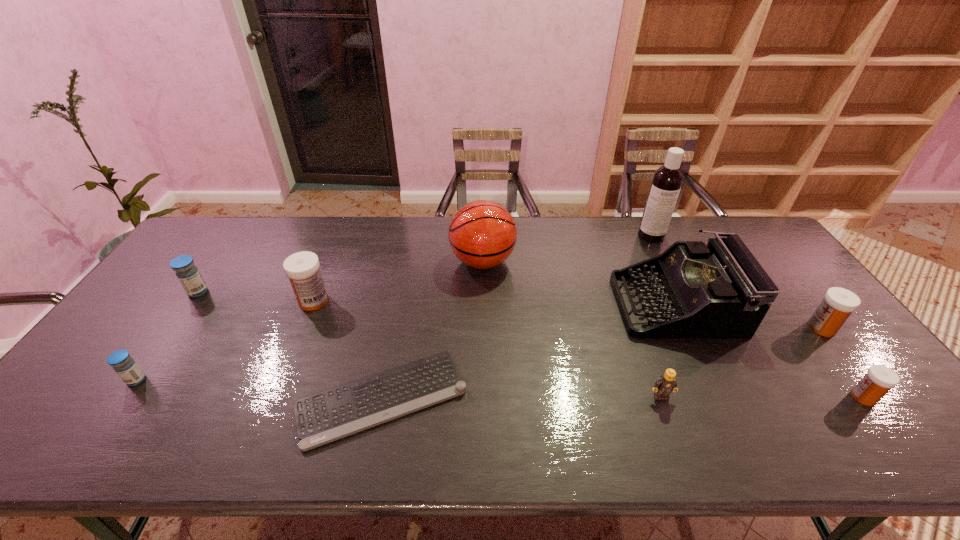
Locate an element on the screen. This screenshot has width=960, height=540. vacant point located 0.110m on the front of the farthest white medicine is located at coordinates (298, 341).

At what (x,y) coordinates should I click in order to perform the action: click on vacant region located on the back of the third farthest medicine. Please return your answer as a coordinate pair (x, y). Looking at the image, I should click on (754, 241).

Find the location of a particular element. vacant position located on the front of the farther blue medicine is located at coordinates (148, 363).

This screenshot has width=960, height=540. In order to click on free location located 0.100m in front of the tan Lego in this screenshot , I will do [x=676, y=439].

Where is `vacant space located on the left of the smaller blue medicine`? The image size is (960, 540). vacant space located on the left of the smaller blue medicine is located at coordinates (84, 380).

What are the coordinates of `free space located on the back of the smallest white medicine` in the screenshot? It's located at (786, 295).

Locate an element on the screen. This screenshot has width=960, height=540. free region located 0.300m on the back of the computer keyboard is located at coordinates (405, 279).

The height and width of the screenshot is (540, 960). In order to click on dishwasher detergent at the far edge in this screenshot , I will do `click(667, 180)`.

Image resolution: width=960 pixels, height=540 pixels. I want to click on basketball situated at the far edge, so click(x=482, y=234).

Image resolution: width=960 pixels, height=540 pixels. I want to click on object at the near edge, so click(324, 417).